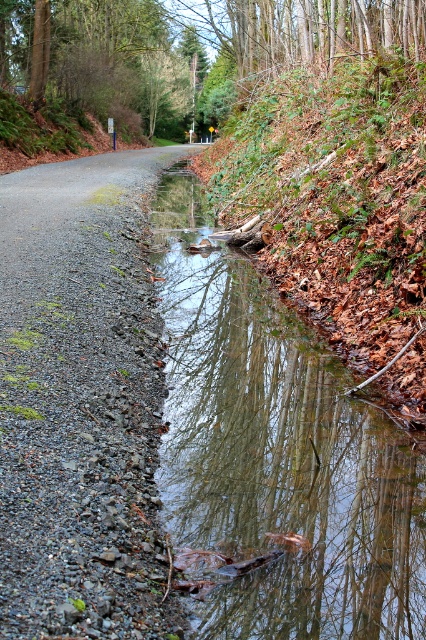
You are a hiker carrying a 10 feet long hiking pole. You want to place the pole horizontally between the clear water at center and the brown leafy hillside at upper right. Will the pole fit without bending?

The distance between the clear water at center and the brown leafy hillside at upper right is 10.55 feet. Since the pole is 10 feet long, it will fit without bending as there is enough space.

You are standing at the point marked by coordinates [80,403] in the image. What feature of the scene are you standing on?

The gray gravel road at center is located at point [80,403], so you are standing on the gray gravel road at center.

You are standing at the edge of the brown leafy hillside at upper right and want to walk to the gray gravel road at center. Which direction should you head to reach it?

You should head to the left to reach the gray gravel road at center since it is located to the left of the brown leafy hillside at upper right.